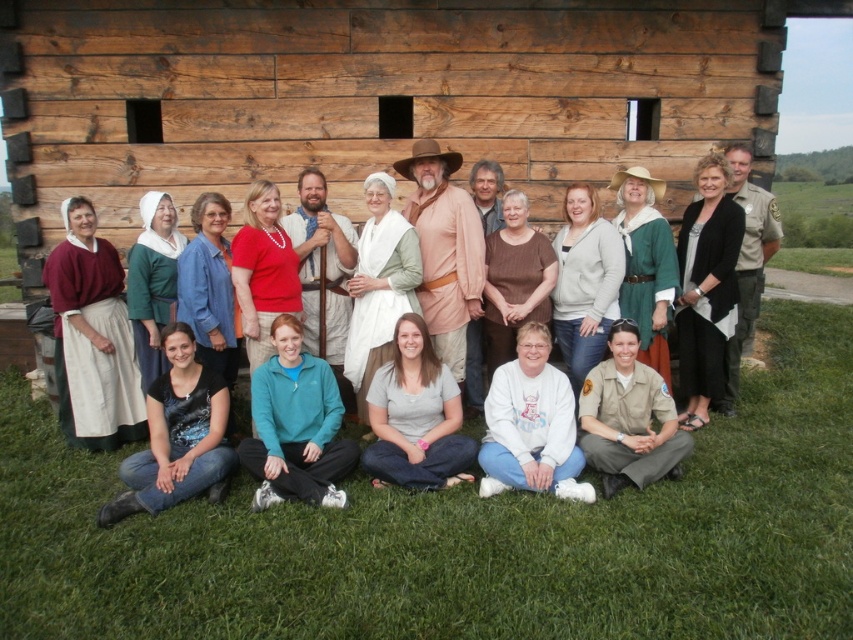
Question: Which point is farther to the camera?

Choices:
 (A) (77, 436)
 (B) (457, 376)
 (C) (737, 147)

Answer: (C)

Question: Does matte burgundy sweater at left have a smaller size compared to teal fleece jacket at lower center?

Choices:
 (A) yes
 (B) no

Answer: (A)

Question: Can you confirm if black sequined top at lower left is thinner than white cotton dress at center?

Choices:
 (A) yes
 (B) no

Answer: (B)

Question: Which of these objects is positioned closest to the teal fleece jacket at lower center?

Choices:
 (A) matte red blouse at center
 (B) brown textured shirt at center

Answer: (A)

Question: Which point is closer to the camera?

Choices:
 (A) teal fleece jacket at lower center
 (B) khaki uniform pants at lower right

Answer: (A)

Question: Where is white cotton dress at center located in relation to brown uniform at right in the image?

Choices:
 (A) above
 (B) below

Answer: (B)